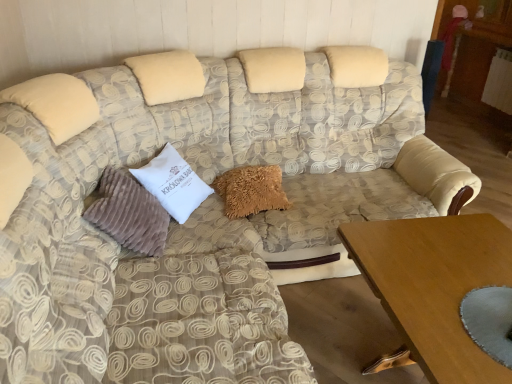
Question: Does suede-like beige pillow at left, acting as the 3th pillow starting from the right, have a lesser height compared to fuzzy beige pillow at center, which appears as the 3th pillow when viewed from the left?

Choices:
 (A) yes
 (B) no

Answer: (B)

Question: Can you confirm if suede-like beige pillow at left, the 1th pillow from the left, is positioned to the right of fuzzy beige pillow at center, the first pillow positioned from the right?

Choices:
 (A) yes
 (B) no

Answer: (B)

Question: Considering the relative sizes of suede-like beige pillow at left, acting as the 3th pillow starting from the right, and fuzzy beige pillow at center, which appears as the 3th pillow when viewed from the left, in the image provided, is suede-like beige pillow at left, acting as the 3th pillow starting from the right, bigger than fuzzy beige pillow at center, which appears as the 3th pillow when viewed from the left,?

Choices:
 (A) yes
 (B) no

Answer: (A)

Question: From the image's perspective, is suede-like beige pillow at left, acting as the 3th pillow starting from the right, located beneath fuzzy beige pillow at center, which appears as the 3th pillow when viewed from the left?

Choices:
 (A) no
 (B) yes

Answer: (B)

Question: Considering the relative positions of suede-like beige pillow at left, the 1th pillow from the left, and fuzzy beige pillow at center, which appears as the 3th pillow when viewed from the left, in the image provided, is suede-like beige pillow at left, the 1th pillow from the left, to the left of fuzzy beige pillow at center, which appears as the 3th pillow when viewed from the left, from the viewer's perspective?

Choices:
 (A) yes
 (B) no

Answer: (A)

Question: From their relative heights in the image, would you say white velvety pillow at center, which is counted as the second pillow, starting from the left, is taller or shorter than fuzzy beige pillow at center, which appears as the 3th pillow when viewed from the left?

Choices:
 (A) tall
 (B) short

Answer: (A)

Question: Considering the relative positions of white velvety pillow at center, which is counted as the second pillow, starting from the left, and fuzzy beige pillow at center, which appears as the 3th pillow when viewed from the left, in the image provided, is white velvety pillow at center, which is counted as the second pillow, starting from the left, to the left or to the right of fuzzy beige pillow at center, which appears as the 3th pillow when viewed from the left,?

Choices:
 (A) left
 (B) right

Answer: (A)

Question: In terms of width, does white velvety pillow at center, the 2th pillow in the right-to-left sequence, look wider or thinner when compared to fuzzy beige pillow at center, the first pillow positioned from the right?

Choices:
 (A) wide
 (B) thin

Answer: (B)

Question: Is white velvety pillow at center, the 2th pillow in the right-to-left sequence, situated inside fuzzy beige pillow at center, which appears as the 3th pillow when viewed from the left, or outside?

Choices:
 (A) outside
 (B) inside

Answer: (A)

Question: From a real-world perspective, is wooden table at lower right physically located above or below white velvety pillow at center, the 2th pillow in the right-to-left sequence?

Choices:
 (A) below
 (B) above

Answer: (A)

Question: Considering their positions, is wooden table at lower right located in front of or behind white velvety pillow at center, which is counted as the second pillow, starting from the left?

Choices:
 (A) behind
 (B) front

Answer: (B)

Question: Do you think wooden table at lower right is within white velvety pillow at center, the 2th pillow in the right-to-left sequence, or outside of it?

Choices:
 (A) inside
 (B) outside

Answer: (B)

Question: Considering the positions of wooden table at lower right and white velvety pillow at center, the 2th pillow in the right-to-left sequence, in the image, is wooden table at lower right bigger or smaller than white velvety pillow at center, the 2th pillow in the right-to-left sequence,?

Choices:
 (A) big
 (B) small

Answer: (A)

Question: From the image's perspective, is fuzzy beige pillow at center, the first pillow positioned from the right, positioned above or below wooden table at lower right?

Choices:
 (A) above
 (B) below

Answer: (A)

Question: Is fuzzy beige pillow at center, the first pillow positioned from the right, in front of or behind wooden table at lower right in the image?

Choices:
 (A) front
 (B) behind

Answer: (B)